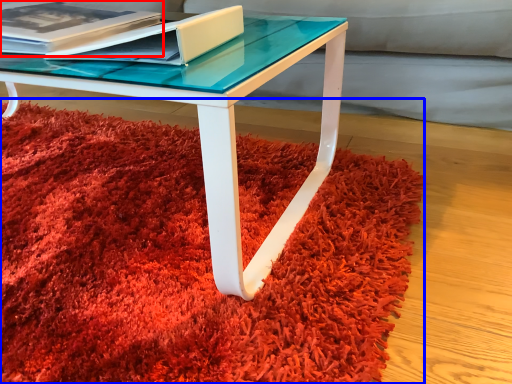
Question: Among these objects, which one is farthest to the camera, paperback book (highlighted by a red box) or mat (highlighted by a blue box)?

Choices:
 (A) paperback book
 (B) mat

Answer: (A)